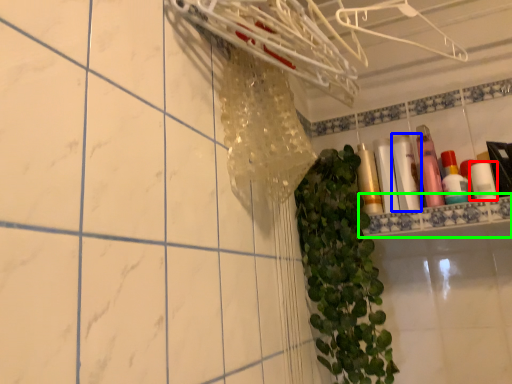
Question: Based on their relative distances, which object is farther from toiletry (highlighted by a red box)? Choose from toiletry (highlighted by a blue box) and ledge (highlighted by a green box).

Choices:
 (A) toiletry
 (B) ledge

Answer: (A)